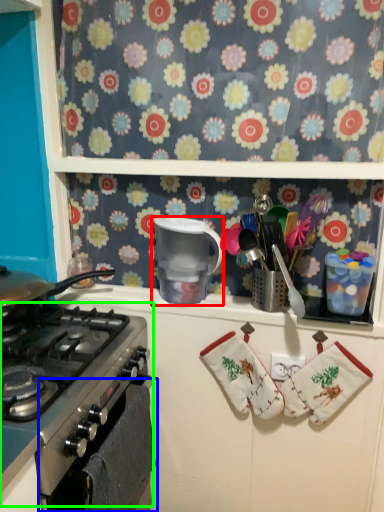
Question: Estimate the real-world distances between objects in this image. Which object is closer to appliance (highlighted by a red box), oven (highlighted by a blue box) or gas stove (highlighted by a green box)?

Choices:
 (A) oven
 (B) gas stove

Answer: (B)